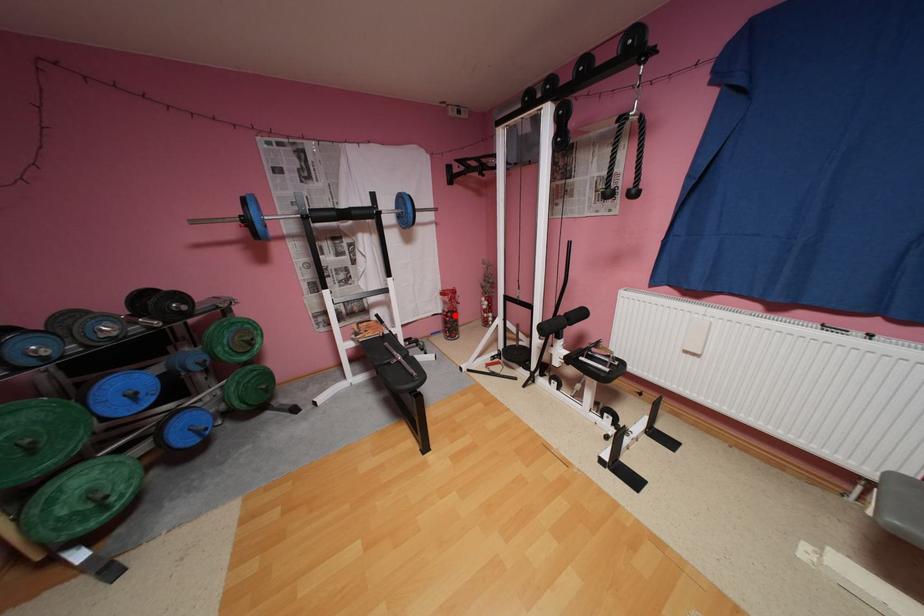
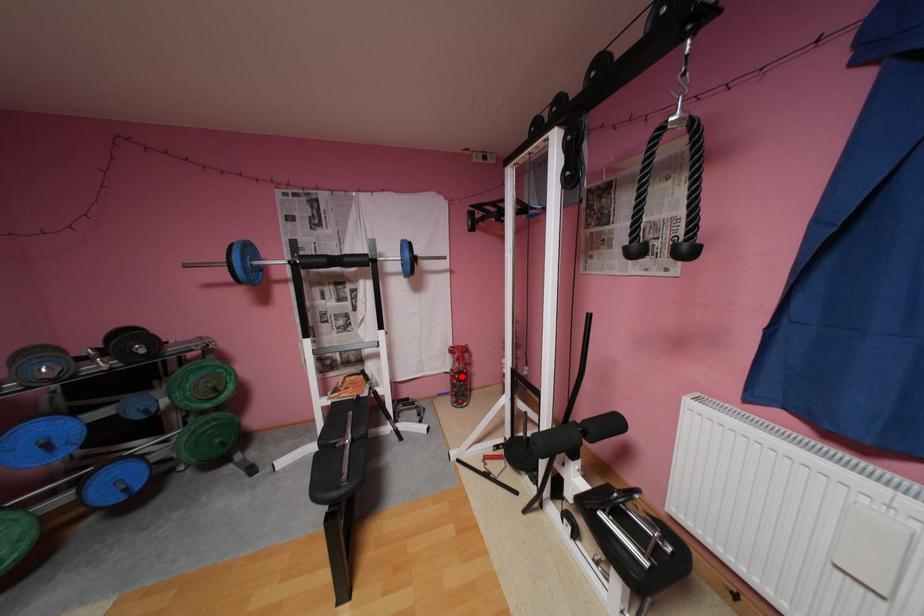
I am providing you with two images of the same scene from different viewpoints. A red point is marked on the first image and another point is marked on the second image. Does the point marked in image1 correspond to the same location as the one in image2?

Yes